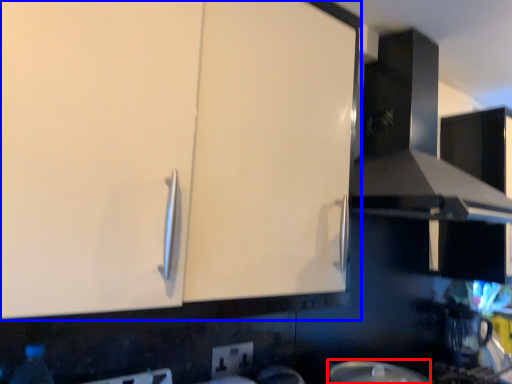
Question: Among these objects, which one is farthest to the camera, appliance (highlighted by a red box) or cabinetry (highlighted by a blue box)?

Choices:
 (A) appliance
 (B) cabinetry

Answer: (A)